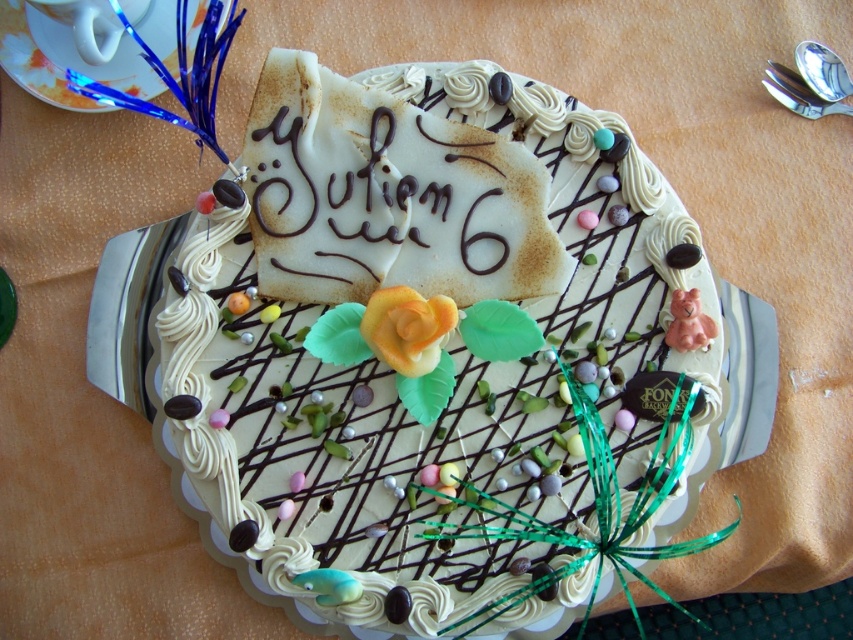
Between white cream cake at center and chocolate writing at center, which one has less height?

chocolate writing at center

In order to click on white cream cake at center in this screenshot , I will do `click(433, 349)`.

Image resolution: width=853 pixels, height=640 pixels. Identify the location of white cream cake at center. [433, 349].

Who is shorter, white cream cake at center or metallic blue platter at upper left?

Standing shorter between the two is metallic blue platter at upper left.

Does white cream cake at center have a greater width compared to metallic blue platter at upper left?

Indeed, white cream cake at center has a greater width compared to metallic blue platter at upper left.

Which is behind, point (491, 422) or point (13, 1)?

Positioned behind is point (13, 1).

Find the location of a particular element. white cream cake at center is located at coordinates (433, 349).

From the picture: Between metallic blue platter at upper left and chocolate writing at center, which one has more height?

Standing taller between the two is chocolate writing at center.

Is metallic blue platter at upper left thinner than chocolate writing at center?

Incorrect, metallic blue platter at upper left's width is not less than chocolate writing at center's.

Is point (135, 44) positioned in front of point (300, 168)?

No, it is behind (300, 168).

At what (x,y) coordinates should I click in order to perform the action: click on metallic blue platter at upper left. Please return your answer as a coordinate pair (x, y). Image resolution: width=853 pixels, height=640 pixels. Looking at the image, I should click on (64, 60).